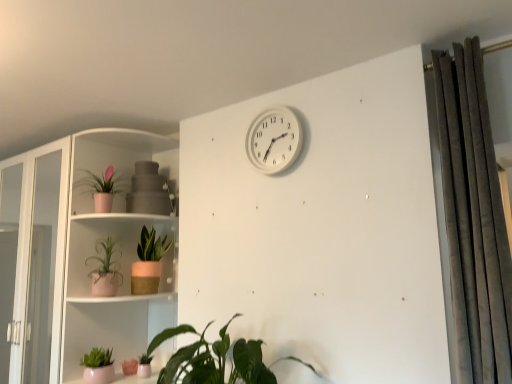
Question: Can you confirm if dark gray velvet curtain at right is bigger than white plastic wall clock at upper center?

Choices:
 (A) yes
 (B) no

Answer: (A)

Question: Can you confirm if dark gray velvet curtain at right is thinner than white plastic wall clock at upper center?

Choices:
 (A) no
 (B) yes

Answer: (A)

Question: Are dark gray velvet curtain at right and white plastic wall clock at upper center making contact?

Choices:
 (A) yes
 (B) no

Answer: (B)

Question: From a real-world perspective, is dark gray velvet curtain at right below white plastic wall clock at upper center?

Choices:
 (A) no
 (B) yes

Answer: (B)

Question: Is white plastic wall clock at upper center at the back of dark gray velvet curtain at right?

Choices:
 (A) yes
 (B) no

Answer: (B)

Question: Based on their positions, is white plastic wall clock at upper center located to the left or right of pink ceramic plant at left?

Choices:
 (A) right
 (B) left

Answer: (A)

Question: In terms of size, does white plastic wall clock at upper center appear bigger or smaller than pink ceramic plant at left?

Choices:
 (A) small
 (B) big

Answer: (A)

Question: In terms of width, does white plastic wall clock at upper center look wider or thinner when compared to pink ceramic plant at left?

Choices:
 (A) wide
 (B) thin

Answer: (B)

Question: Is white plastic wall clock at upper center spatially inside pink ceramic plant at left, or outside of it?

Choices:
 (A) inside
 (B) outside

Answer: (B)

Question: Is point (274, 147) positioned closer to the camera than point (155, 271)?

Choices:
 (A) closer
 (B) farther

Answer: (A)

Question: In the image, is white plastic wall clock at upper center positioned in front of or behind green matte plant pot at center-left, the 1th houseplant in the back-to-front sequence?

Choices:
 (A) front
 (B) behind

Answer: (A)

Question: From a real-world perspective, is white plastic wall clock at upper center above or below green matte plant pot at center-left, marked as the sixth houseplant in a front-to-back arrangement?

Choices:
 (A) below
 (B) above

Answer: (B)

Question: Looking at the image, does white plastic wall clock at upper center seem bigger or smaller compared to green matte plant pot at center-left, the 1th houseplant in the back-to-front sequence?

Choices:
 (A) big
 (B) small

Answer: (B)

Question: Considering their positions, is green matte plant pot at center-left, the 1th houseplant in the back-to-front sequence, located in front of or behind pink ceramic plant at left?

Choices:
 (A) behind
 (B) front

Answer: (A)

Question: From their relative heights in the image, would you say green matte plant pot at center-left, the 1th houseplant in the back-to-front sequence, is taller or shorter than pink ceramic plant at left?

Choices:
 (A) tall
 (B) short

Answer: (B)